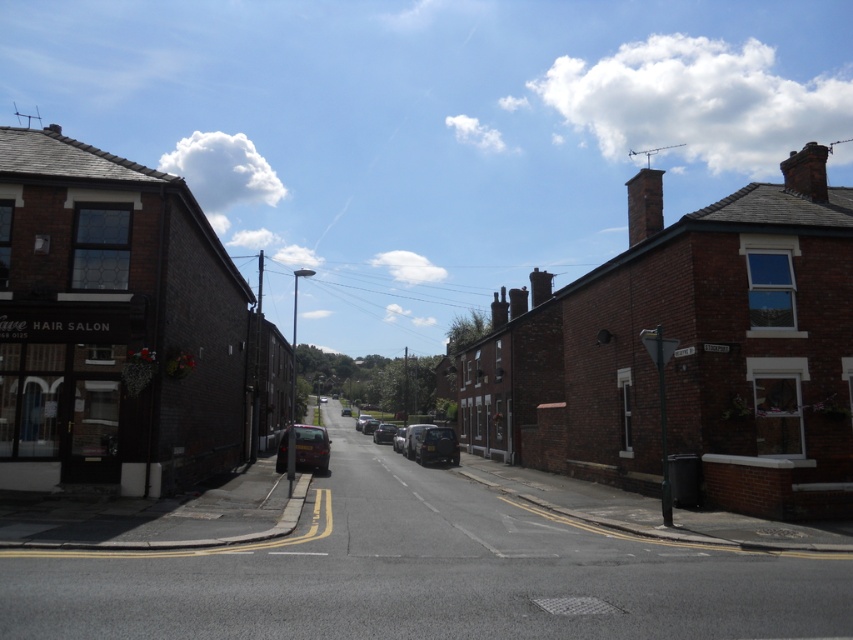
Question: Does smooth asphalt road at center lie behind shiny silver car at center?

Choices:
 (A) no
 (B) yes

Answer: (A)

Question: Among these points, which one is farthest from the camera?

Choices:
 (A) (428, 433)
 (B) (401, 428)
 (C) (318, 458)

Answer: (B)

Question: Among these points, which one is farthest from the camera?

Choices:
 (A) (396, 444)
 (B) (390, 424)
 (C) (456, 460)

Answer: (B)

Question: Is shiny black car at center smaller than metallic silver car at center?

Choices:
 (A) no
 (B) yes

Answer: (A)

Question: In this image, where is smooth asphalt road at center located relative to shiny silver car at center?

Choices:
 (A) below
 (B) above

Answer: (B)

Question: Among these objects, which one is farthest from the camera?

Choices:
 (A) metallic gray car at center
 (B) smooth asphalt road at center
 (C) metallic silver van at center
 (D) shiny black car at center

Answer: (A)